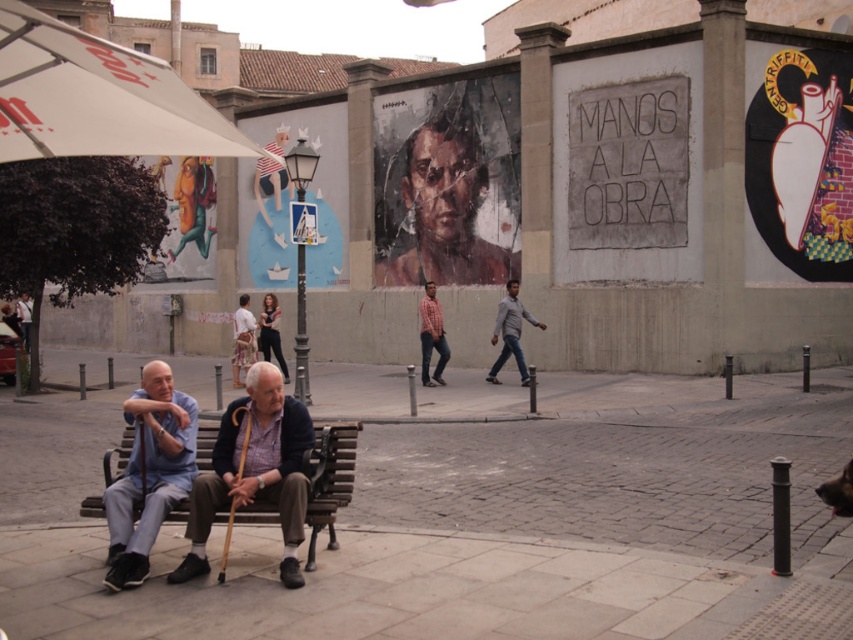
Who is higher up, light brown wooden cane at center or matte black pants at center?

matte black pants at center

What do you see at coordinates (254, 470) in the screenshot? This screenshot has height=640, width=853. I see `light brown wooden cane at center` at bounding box center [254, 470].

Is point (283, 515) closer to viewer compared to point (238, 330)?

Yes.

Where is `light brown wooden cane at center`? This screenshot has width=853, height=640. light brown wooden cane at center is located at coordinates (254, 470).

Is matte black pants at center to the left of light brown fabric shirt at center from the viewer's perspective?

No, matte black pants at center is not to the left of light brown fabric shirt at center.

Can you confirm if matte black pants at center is positioned to the right of light brown fabric shirt at center?

Yes, matte black pants at center is to the right of light brown fabric shirt at center.

Between point (238, 349) and point (234, 358), which one is positioned in front?

Positioned in front is point (238, 349).

The height and width of the screenshot is (640, 853). What are the coordinates of `matte black pants at center` in the screenshot? It's located at (257, 337).

Is point (19, 67) closer to camera compared to point (347, 499)?

Yes, it is.

Who is more forward, (16, 29) or (309, 509)?

Point (16, 29) is more forward.

What do you see at coordinates (96, 97) in the screenshot? I see `white fabric umbrella at upper left` at bounding box center [96, 97].

Where is `white fabric umbrella at upper left`? white fabric umbrella at upper left is located at coordinates (96, 97).